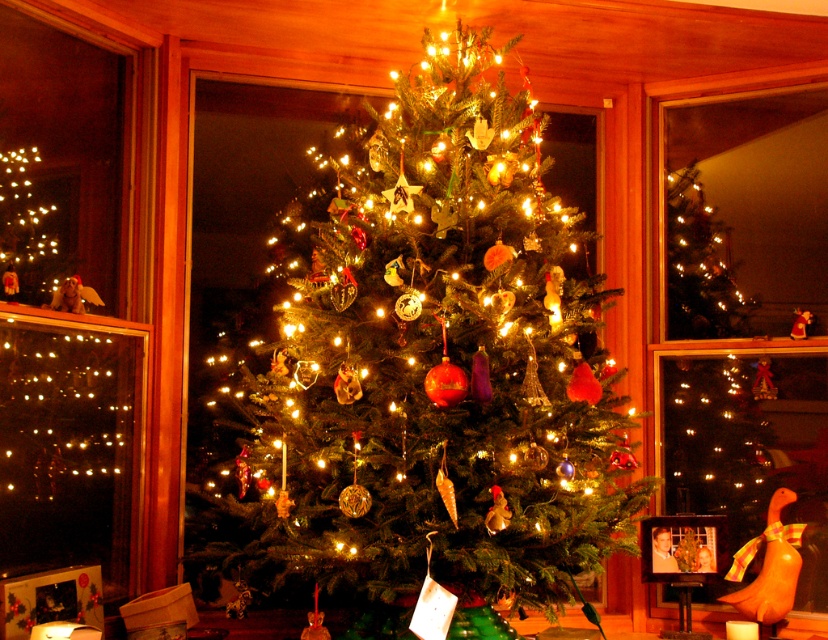
Is clear glass window at upper left behind clear glass window at center?

No, it is not.

Can you confirm if clear glass window at upper left is smaller than clear glass window at center?

Yes.

Which is behind, point (82, 100) or point (706, 420)?

Positioned behind is point (706, 420).

The width and height of the screenshot is (828, 640). I want to click on clear glass window at upper left, so click(x=66, y=308).

Based on the photo, who is lower down, green matte christmas tree at center or clear glass window at center?

clear glass window at center is lower down.

Where is `green matte christmas tree at center`? green matte christmas tree at center is located at coordinates (417, 368).

Between green matte christmas tree at center and clear glass window at upper left, which one is positioned higher?

clear glass window at upper left

Can you confirm if green matte christmas tree at center is taller than clear glass window at upper left?

Correct, green matte christmas tree at center is much taller as clear glass window at upper left.

Identify the location of green matte christmas tree at center. (417, 368).